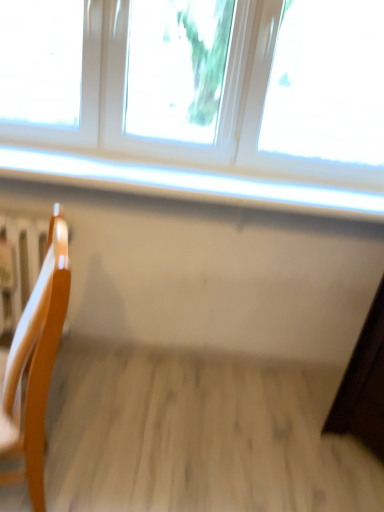
Question: Is wooden radiator at left oriented away from light wood chair at left?

Choices:
 (A) yes
 (B) no

Answer: (B)

Question: From a real-world perspective, does wooden radiator at left sit lower than light wood chair at left?

Choices:
 (A) yes
 (B) no

Answer: (A)

Question: Is light wood chair at left surrounded by wooden radiator at left?

Choices:
 (A) no
 (B) yes

Answer: (A)

Question: From the image's perspective, is wooden radiator at left over light wood chair at left?

Choices:
 (A) no
 (B) yes

Answer: (B)

Question: Can you confirm if wooden radiator at left is shorter than light wood chair at left?

Choices:
 (A) yes
 (B) no

Answer: (A)

Question: Is the depth of wooden radiator at left less than that of light wood chair at left?

Choices:
 (A) no
 (B) yes

Answer: (A)

Question: Does white glossy window sill at upper center have a lesser width compared to wooden radiator at left?

Choices:
 (A) no
 (B) yes

Answer: (A)

Question: Does white glossy window sill at upper center have a smaller size compared to wooden radiator at left?

Choices:
 (A) no
 (B) yes

Answer: (B)

Question: Is the depth of white glossy window sill at upper center less than that of wooden radiator at left?

Choices:
 (A) no
 (B) yes

Answer: (B)

Question: From the image's perspective, is white glossy window sill at upper center located above wooden radiator at left?

Choices:
 (A) yes
 (B) no

Answer: (A)

Question: Is white glossy window sill at upper center positioned with its back to wooden radiator at left?

Choices:
 (A) no
 (B) yes

Answer: (A)

Question: Could you tell me if white glossy window sill at upper center is turned towards wooden radiator at left?

Choices:
 (A) no
 (B) yes

Answer: (A)

Question: Could you tell me if white glossy window sill at upper center is facing light wood chair at left?

Choices:
 (A) yes
 (B) no

Answer: (B)